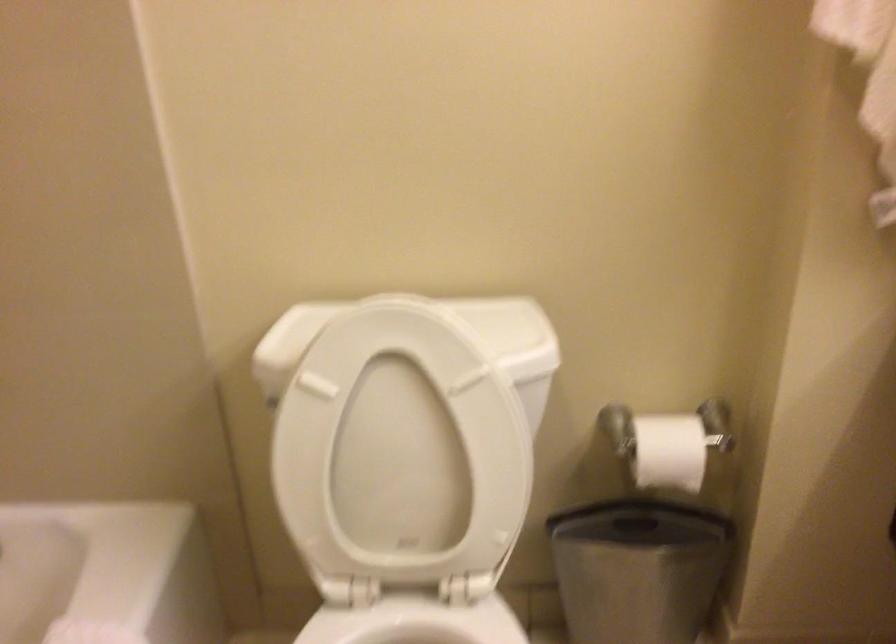
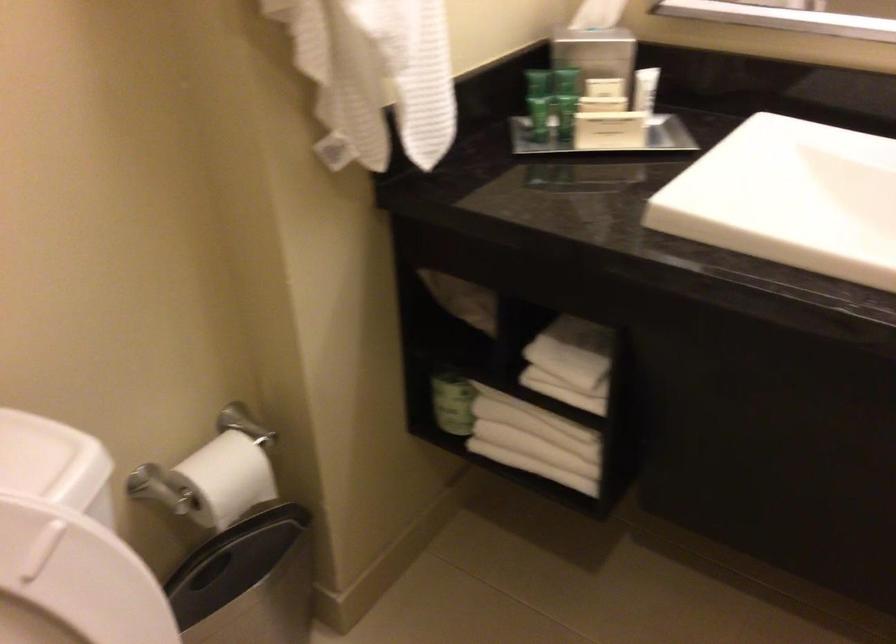
Locate, in the second image, the point that corresponds to point 472,408 in the first image.

(73, 582)